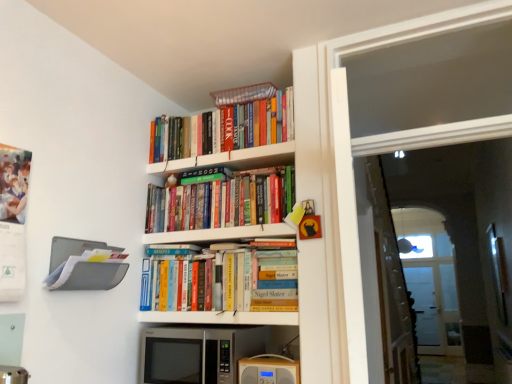
Question: Considering the relative sizes of white glossy bookshelf at upper center, which is the 2th shelf in top-to-bottom order, and transparent glass door at upper right in the image provided, is white glossy bookshelf at upper center, which is the 2th shelf in top-to-bottom order, smaller than transparent glass door at upper right?

Choices:
 (A) yes
 (B) no

Answer: (A)

Question: Is white glossy bookshelf at upper center, which is the 2th shelf in top-to-bottom order, further to the viewer compared to transparent glass door at upper right?

Choices:
 (A) no
 (B) yes

Answer: (B)

Question: Can we say white glossy bookshelf at upper center, which is the 2th shelf in top-to-bottom order, lies outside transparent glass door at upper right?

Choices:
 (A) no
 (B) yes

Answer: (B)

Question: Is white glossy bookshelf at upper center, marked as the third shelf in a bottom-to-top arrangement, thinner than transparent glass door at upper right?

Choices:
 (A) no
 (B) yes

Answer: (A)

Question: From a real-world perspective, is white glossy bookshelf at upper center, marked as the third shelf in a bottom-to-top arrangement, below transparent glass door at upper right?

Choices:
 (A) no
 (B) yes

Answer: (B)

Question: Is white glossy bookshelf at upper center, marked as the third shelf in a bottom-to-top arrangement, bigger than transparent glass door at upper right?

Choices:
 (A) no
 (B) yes

Answer: (A)

Question: Is hardcover books at center, positioned as the 1th shelf in bottom-to-top order, smaller than hardcover books at upper center, positioned as the second book in bottom-to-top order?

Choices:
 (A) yes
 (B) no

Answer: (A)

Question: From the image's perspective, is hardcover books at center, the fourth shelf when ordered from top to bottom, located above hardcover books at upper center, positioned as the second book in bottom-to-top order?

Choices:
 (A) no
 (B) yes

Answer: (A)

Question: Can you confirm if hardcover books at center, positioned as the 1th shelf in bottom-to-top order, is positioned to the left of hardcover books at upper center, positioned as the second book in bottom-to-top order?

Choices:
 (A) yes
 (B) no

Answer: (B)

Question: Can you confirm if hardcover books at center, the fourth shelf when ordered from top to bottom, is shorter than hardcover books at upper center, positioned as the second book in bottom-to-top order?

Choices:
 (A) no
 (B) yes

Answer: (B)

Question: Considering the relative sizes of hardcover books at center, the fourth shelf when ordered from top to bottom, and hardcover books at upper center, the 2th book when ordered from top to bottom, in the image provided, is hardcover books at center, the fourth shelf when ordered from top to bottom, thinner than hardcover books at upper center, the 2th book when ordered from top to bottom,?

Choices:
 (A) no
 (B) yes

Answer: (A)

Question: Does hardcover books at center, the fourth shelf when ordered from top to bottom, lie in front of hardcover books at upper center, the 2th book when ordered from top to bottom?

Choices:
 (A) no
 (B) yes

Answer: (B)

Question: Is hardcover books at center, positioned as the 1th shelf in bottom-to-top order, oriented towards transparent glass door at upper right?

Choices:
 (A) yes
 (B) no

Answer: (B)